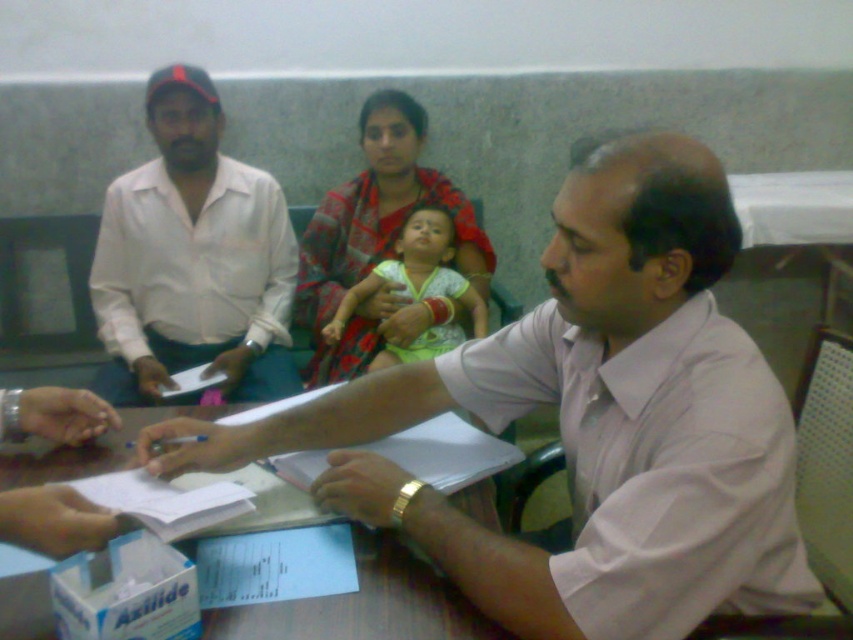
Question: Does white cotton shirt at left have a greater width compared to light green fabric baby at center?

Choices:
 (A) yes
 (B) no

Answer: (A)

Question: Considering the real-world distances, which object is farthest from the white paper at center?

Choices:
 (A) light green fabric baby at center
 (B) pink fabric shirt at center
 (C) white cotton shirt at left

Answer: (C)

Question: Among these objects, which one is nearest to the camera?

Choices:
 (A) white cotton shirt at left
 (B) light green fabric baby at center
 (C) white paper at center

Answer: (C)

Question: Is pink fabric shirt at center bigger than white cotton shirt at left?

Choices:
 (A) yes
 (B) no

Answer: (A)

Question: Which object appears farthest from the camera in this image?

Choices:
 (A) pink fabric shirt at center
 (B) white paper at center
 (C) light green fabric baby at center
 (D) white cotton shirt at left

Answer: (C)

Question: Is pink fabric shirt at center to the right of white paper at center from the viewer's perspective?

Choices:
 (A) yes
 (B) no

Answer: (A)